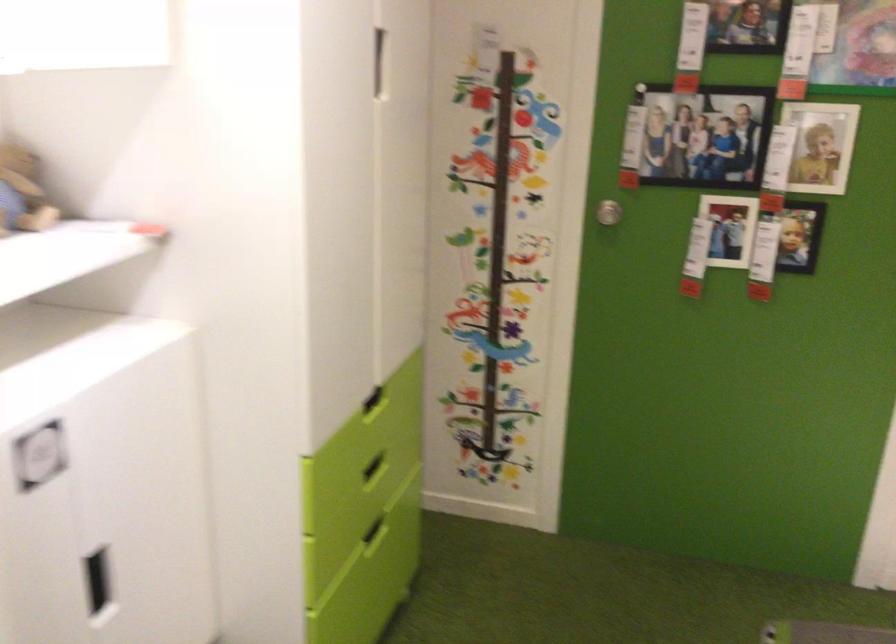
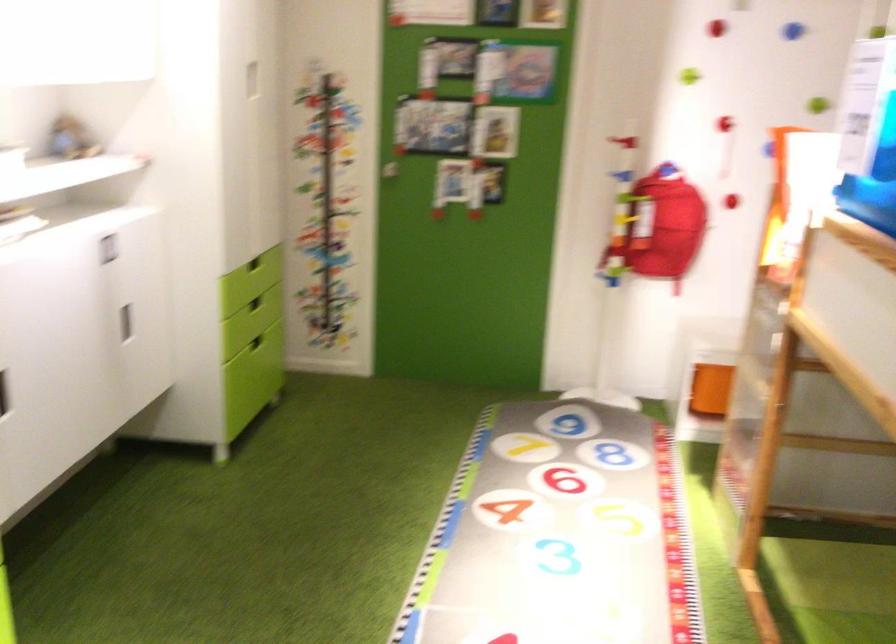
The point at (373, 401) is marked in the first image. Where is the corresponding point in the second image?

(253, 277)